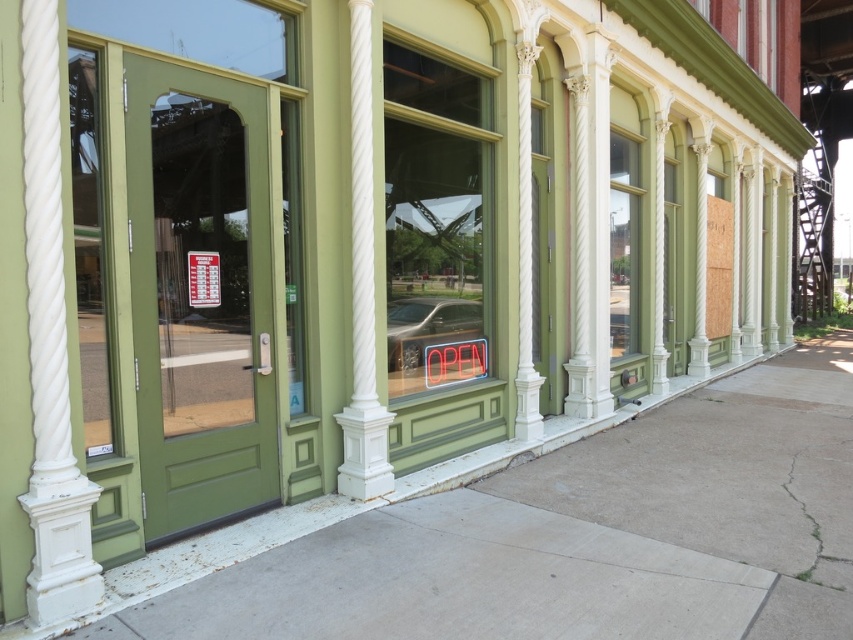
Question: Among these points, which one is nearest to the camera?

Choices:
 (A) (447, 364)
 (B) (701, 608)
 (C) (41, 420)
 (D) (86, 410)

Answer: (C)

Question: Is matte glass window at center above white textured column at center?

Choices:
 (A) yes
 (B) no

Answer: (A)

Question: Is white textured column at left further to the viewer compared to white textured column at center?

Choices:
 (A) yes
 (B) no

Answer: (B)

Question: Which point appears closest to the camera in this image?

Choices:
 (A) (350, 200)
 (B) (850, 474)

Answer: (A)

Question: Which point is farther to the camera?

Choices:
 (A) green glass door at left
 (B) white textured column at center
 (C) white textured column at left

Answer: (B)

Question: Is gray concrete sidewalk at center positioned in front of green glass door at left?

Choices:
 (A) yes
 (B) no

Answer: (A)